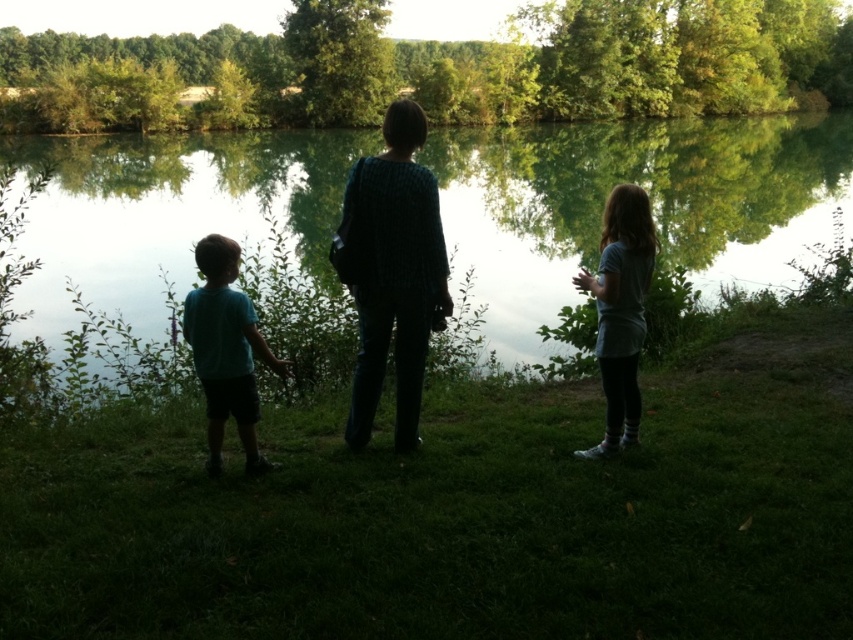
You are a photographer trying to capture the reflection of the dark green textured sweater at center in the green reflective water at center. Is the sweater visible in the water?

The dark green textured sweater at center is behind the green reflective water at center, so its reflection would not be visible in the water since it is not in front of the reflective surface.

You are a photographer trying to capture the scene with the green reflective water at center and the matte teal shirt at left. Based on their positions, which object is closer to the left edge of the photo?

The matte teal shirt at left is closer to the left edge of the photo because the green reflective water at center is positioned on its left side, meaning the shirt is further right relative to the water.

You are a photographer trying to capture the scene of three people on a grassy bank overlooking a lake. You want to ensure the dark green textured sweater at center is in the frame. Based on its coordinates, where should you position your camera to include it?

The dark green textured sweater at center is located at coordinates point (392, 273), so positioning the camera to frame the center of the image around these coordinates will ensure the sweater is included.